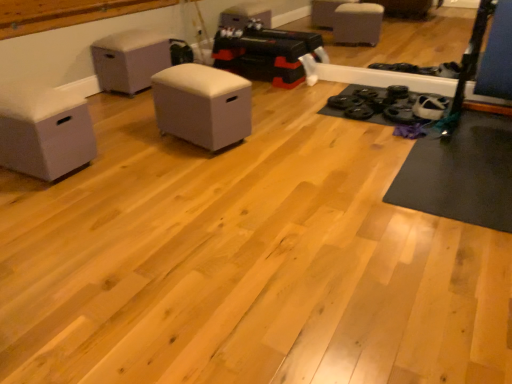
Question: Is point (95, 142) positioned closer to the camera than point (188, 107)?

Choices:
 (A) closer
 (B) farther

Answer: (A)

Question: Is white fabric ottoman at left, which ranks as the 1th furniture in front-to-back order, situated inside white fabric ottoman at center, placed as the third furniture when sorted from left to right, or outside?

Choices:
 (A) inside
 (B) outside

Answer: (B)

Question: Estimate the real-world distances between objects in this image. Which object is closer to the white fabric ottoman at center, the second furniture positioned from the right?

Choices:
 (A) white fabric ottoman at left, which ranks as the 1th furniture in front-to-back order
 (B) white fabric ottoman at center, marked as the 2th furniture in a front-to-back arrangement

Answer: (B)

Question: Which is nearer to the white fabric ottoman at left, the third furniture viewed from the right?

Choices:
 (A) white fabric ottoman at center, acting as the 1th furniture starting from the back
 (B) white fabric ottoman at center, which is counted as the first furniture, starting from the right

Answer: (B)